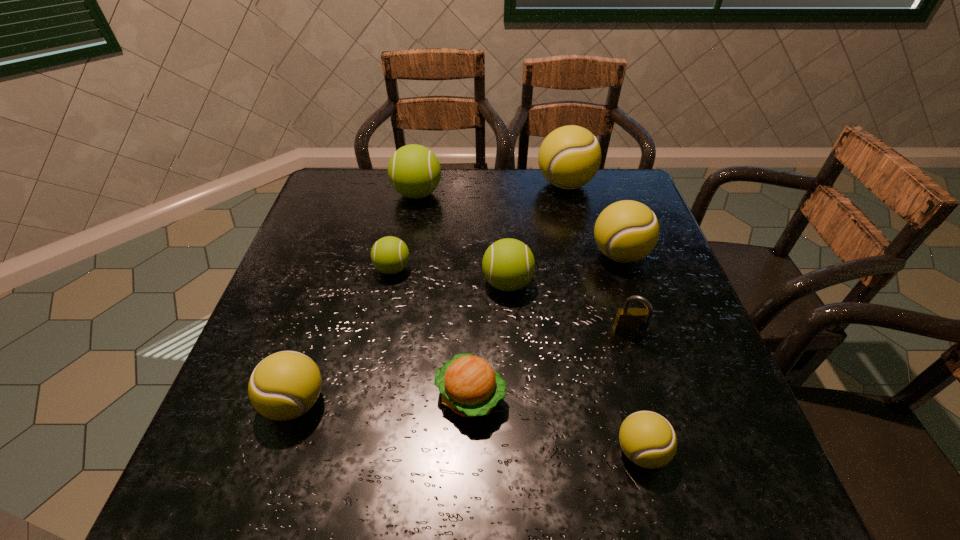
At what (x,y) coordinates should I click in order to perform the action: click on the biggest yellow tennis ball. Please return your answer as a coordinate pair (x, y). The image size is (960, 540). Looking at the image, I should click on (569, 157).

I want to click on the tallest object, so click(x=569, y=157).

Find the location of `the biggest green tennis ball`. the biggest green tennis ball is located at coordinates (414, 171).

Where is `the second biggest yellow tennis ball`? The height and width of the screenshot is (540, 960). the second biggest yellow tennis ball is located at coordinates (626, 231).

At what (x,y) coordinates should I click in order to perform the action: click on the second biggest green tennis ball. Please return your answer as a coordinate pair (x, y). The width and height of the screenshot is (960, 540). Looking at the image, I should click on (508, 264).

Where is `the fourth tennis ball from right to left`? the fourth tennis ball from right to left is located at coordinates point(508,264).

This screenshot has height=540, width=960. I want to click on the leftmost object, so click(x=285, y=385).

Identify the location of the third biggest yellow tennis ball. Image resolution: width=960 pixels, height=540 pixels. (285, 385).

Find the location of a particular element. padlock is located at coordinates (628, 320).

The height and width of the screenshot is (540, 960). Find the location of `hamburger`. hamburger is located at coordinates (470, 387).